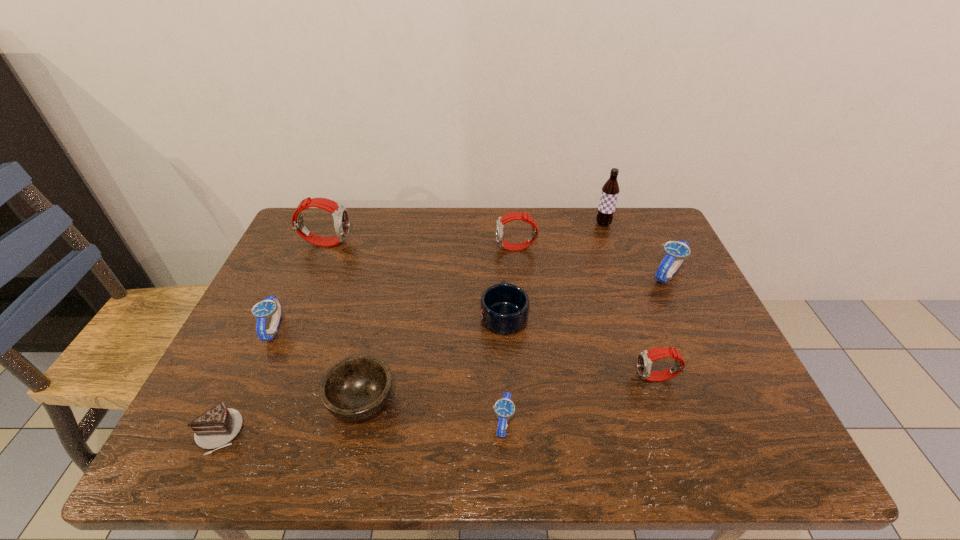
Where is `vacant area situated 0.230m with the handle on the side of the blue mug`? The width and height of the screenshot is (960, 540). vacant area situated 0.230m with the handle on the side of the blue mug is located at coordinates (500, 242).

I want to click on free space located on the right of the fourth object from left to right, so click(x=481, y=401).

This screenshot has width=960, height=540. Identify the location of vacant space located 0.390m on the back of the second blue watch from right to left. (497, 279).

The height and width of the screenshot is (540, 960). In order to click on vacant area situated 0.060m on the right of the chocolate cake in this screenshot , I will do `click(270, 433)`.

This screenshot has width=960, height=540. What are the coordinates of `root beer positioned at the far edge` in the screenshot? It's located at (610, 190).

Find the location of a particular element. The width and height of the screenshot is (960, 540). bowl located at the near edge is located at coordinates (356, 387).

At what (x,y) coordinates should I click in order to perform the action: click on watch that is positioned at the near edge. Please return your answer as a coordinate pair (x, y). This screenshot has width=960, height=540. Looking at the image, I should click on (504, 408).

At what (x,y) coordinates should I click in order to perform the action: click on chocolate cake that is at the near edge. Please return your answer as a coordinate pair (x, y). The height and width of the screenshot is (540, 960). Looking at the image, I should click on (216, 427).

At what (x,y) coordinates should I click in order to perform the action: click on chocolate cake at the left edge. Please return your answer as a coordinate pair (x, y). This screenshot has height=540, width=960. Looking at the image, I should click on (216, 427).

The width and height of the screenshot is (960, 540). In order to click on root beer that is at the right edge in this screenshot , I will do [x=610, y=190].